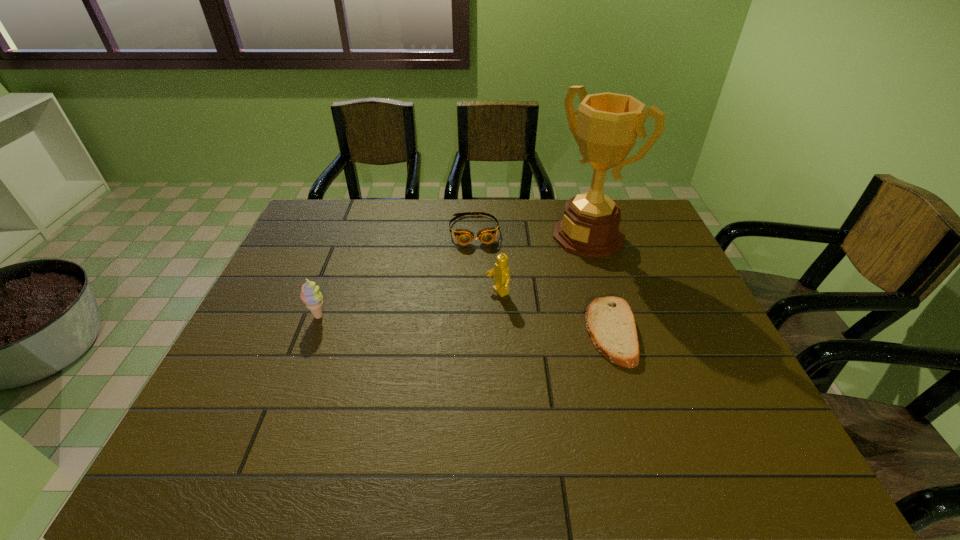
The width and height of the screenshot is (960, 540). Find the location of `vacant space on the desktop that is between the leftmost object and the shortest object and is positioned on the front-facing side of the award`. vacant space on the desktop that is between the leftmost object and the shortest object and is positioned on the front-facing side of the award is located at coordinates (448, 323).

Find the location of a particular element. free spot on the desktop that is between the leftmost object and the pita bread and is positioned with the lenses facing forward on the goggles is located at coordinates (488, 325).

The width and height of the screenshot is (960, 540). Find the location of `vacant spot on the desktop that is between the leftmost object and the pita bread and is positioned on the face of the Lego`. vacant spot on the desktop that is between the leftmost object and the pita bread and is positioned on the face of the Lego is located at coordinates (430, 322).